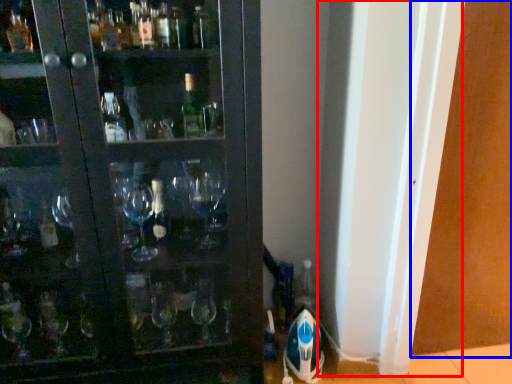
Question: Which point is closer to the camera, screen door (highlighted by a red box) or screen door (highlighted by a blue box)?

Choices:
 (A) screen door
 (B) screen door

Answer: (A)